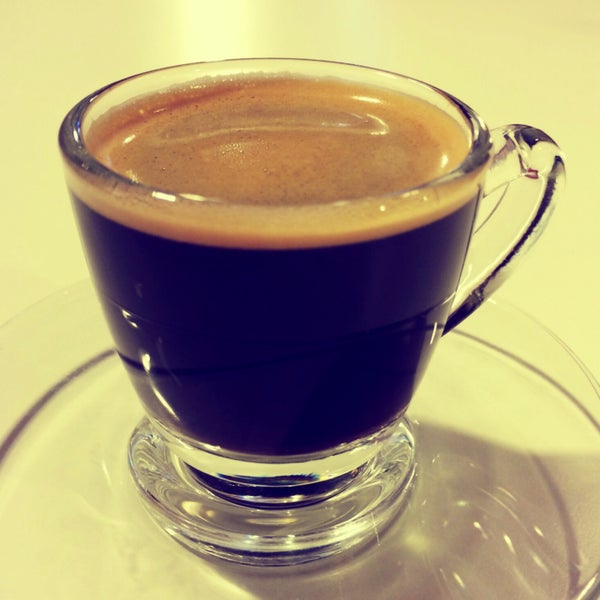
Find the location of a particular element. The image size is (600, 600). glass base is located at coordinates (321, 529).